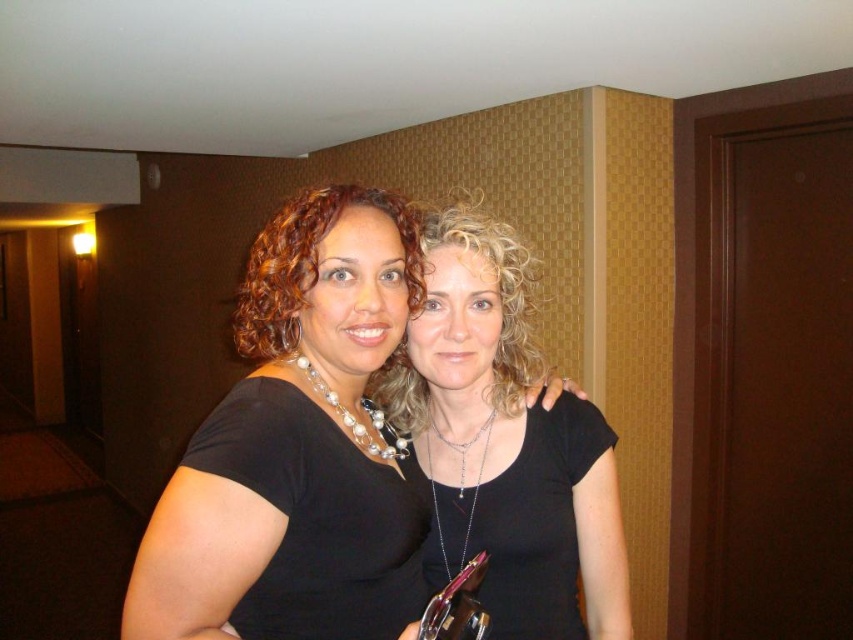
Question: Does black matte shirt at center appear on the right side of black matte necklace at center?

Choices:
 (A) no
 (B) yes

Answer: (A)

Question: Which object is farther from the camera taking this photo?

Choices:
 (A) black matte shirt at center
 (B) black matte necklace at center

Answer: (B)

Question: Does black matte shirt at center appear on the left side of black matte necklace at center?

Choices:
 (A) no
 (B) yes

Answer: (B)

Question: Is black matte shirt at center to the right of black matte necklace at center from the viewer's perspective?

Choices:
 (A) yes
 (B) no

Answer: (B)